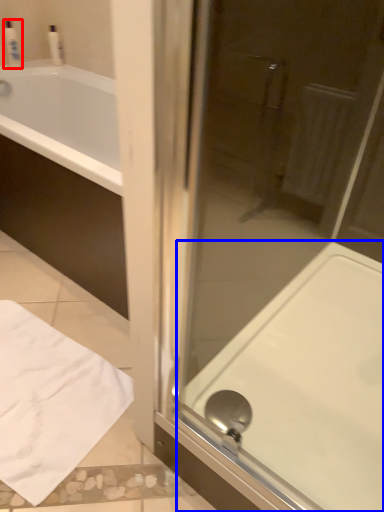
Question: Which of the following is the closest to the observer, toiletry (highlighted by a red box) or bath (highlighted by a blue box)?

Choices:
 (A) toiletry
 (B) bath

Answer: (B)